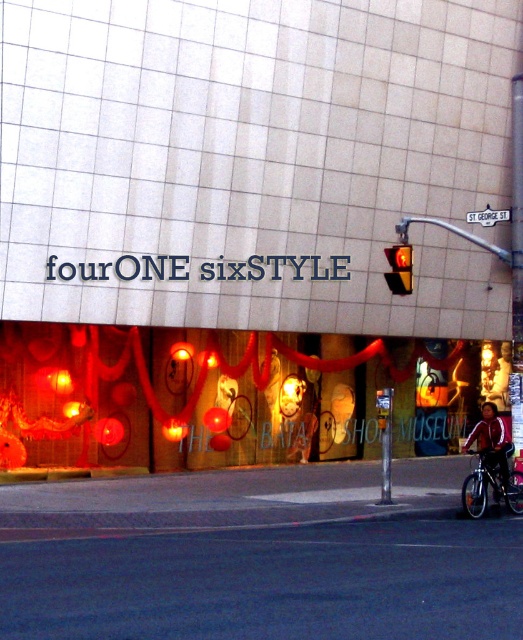
Between point (471, 506) and point (396, 289), which one is positioned in front?

Point (471, 506) is more forward.

Which is behind, point (490, 461) or point (389, 260)?

The point (389, 260) is more distant.

Find the location of `shiny black bicycle at lower right`. shiny black bicycle at lower right is located at coordinates (491, 486).